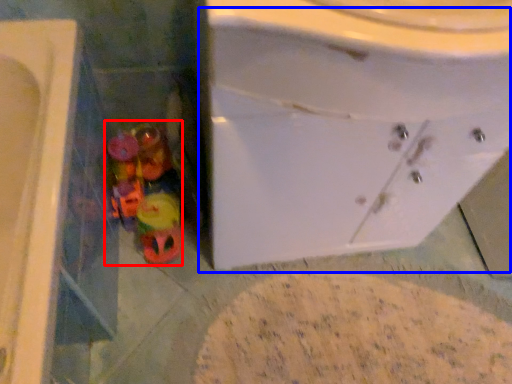
Question: Which object appears farthest to the camera in this image, toy (highlighted by a red box) or sink (highlighted by a blue box)?

Choices:
 (A) toy
 (B) sink

Answer: (A)